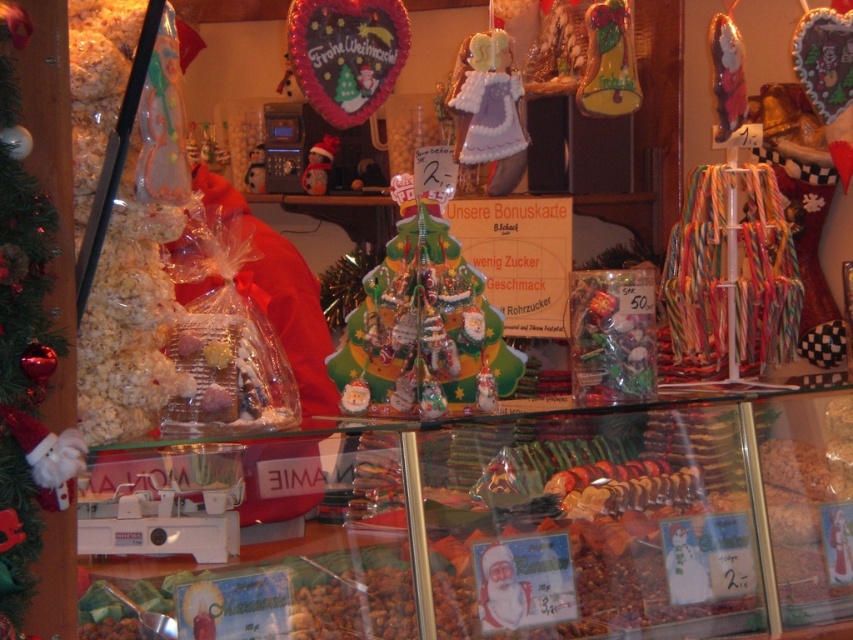
Is shiny red bauble at left to the right of shiny green candy at center from the viewer's perspective?

Incorrect, shiny red bauble at left is not on the right side of shiny green candy at center.

Can you confirm if shiny red bauble at left is positioned above shiny green candy at center?

No, shiny red bauble at left is not above shiny green candy at center.

I want to click on shiny red bauble at left, so click(x=33, y=324).